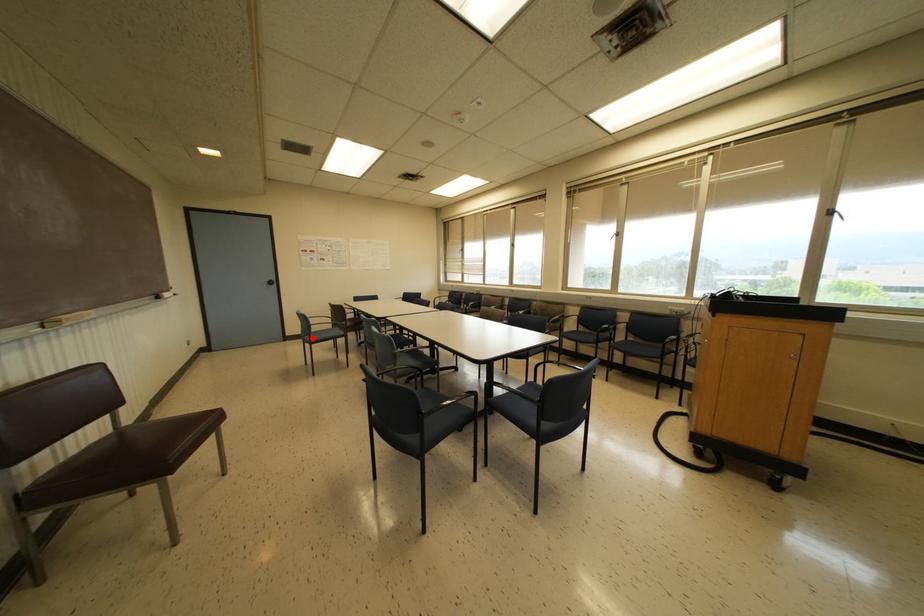
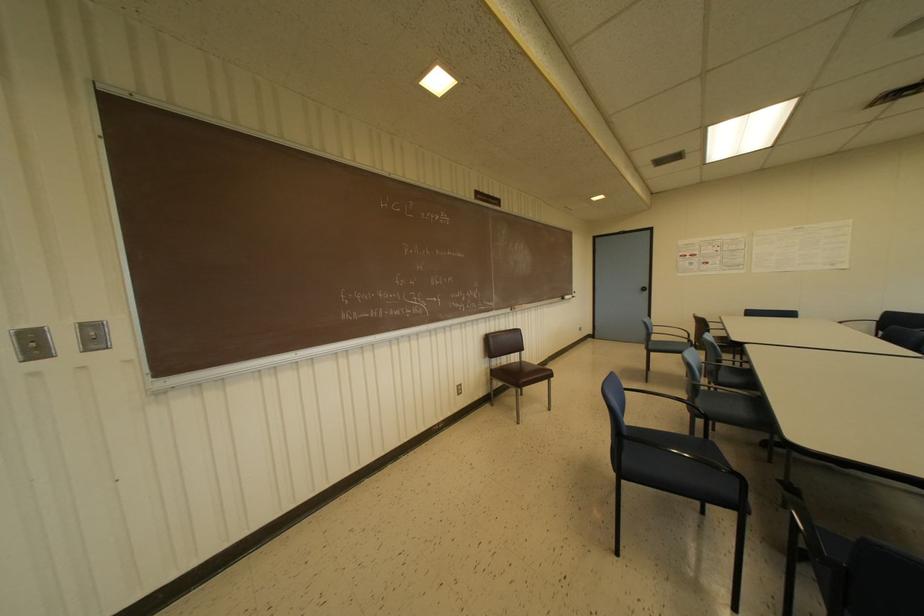
In the second image, find the point that corresponds to the highlighted location in the first image.

(650, 346)